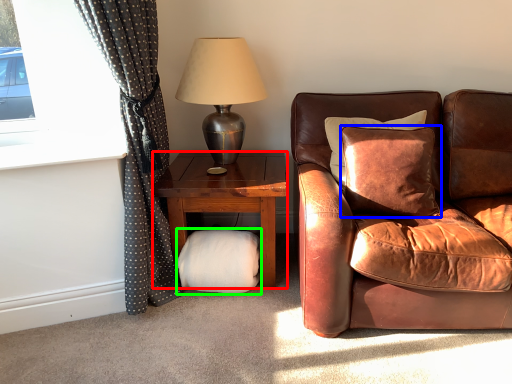
Question: Considering the real-world distances, which object is farthest from studio couch (highlighted by a red box)? pillow (highlighted by a blue box) or footrest (highlighted by a green box)?

Choices:
 (A) pillow
 (B) footrest

Answer: (A)